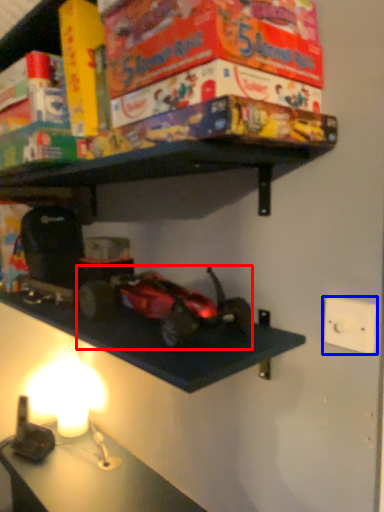
Question: Which point is closer to the camera, toy (highlighted by a red box) or light switch (highlighted by a blue box)?

Choices:
 (A) toy
 (B) light switch

Answer: (A)